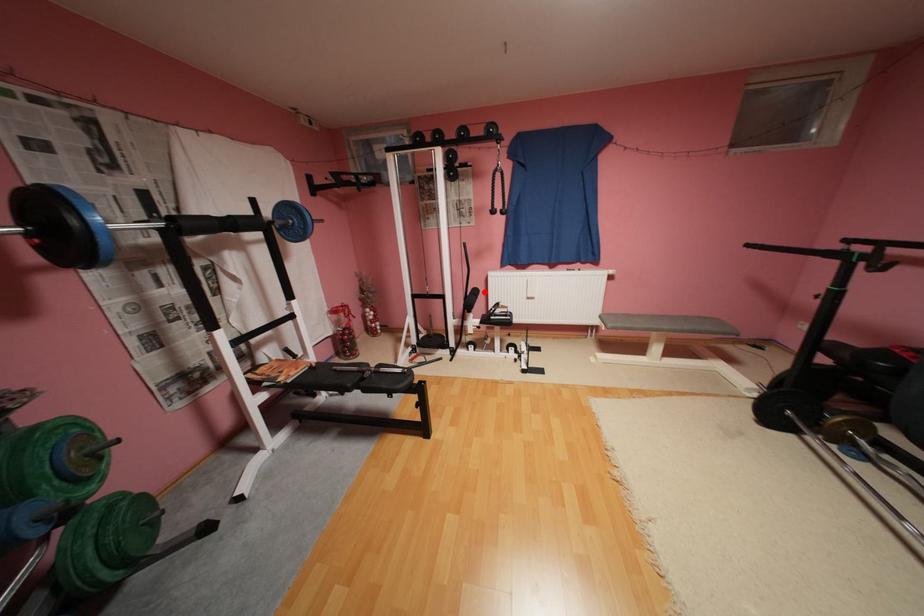
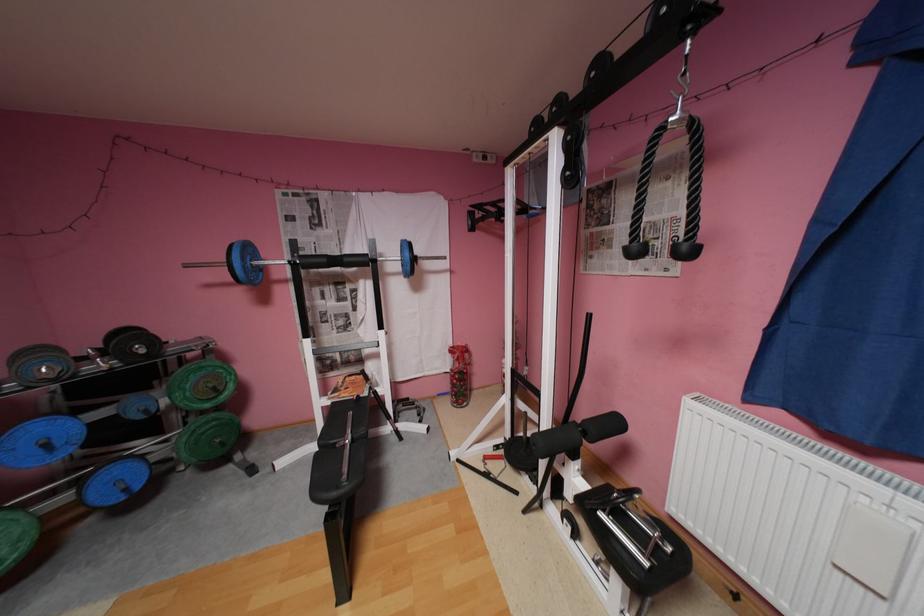
The point at the highlighted location is marked in the first image. Where is the corresponding point in the second image?

(624, 424)